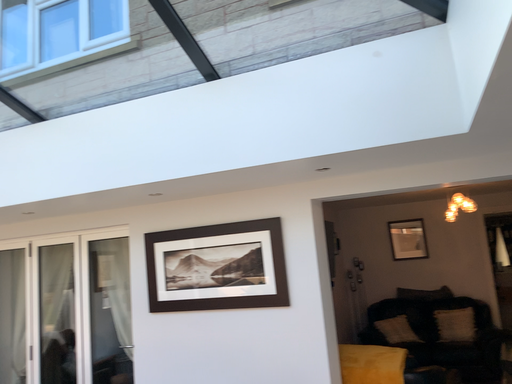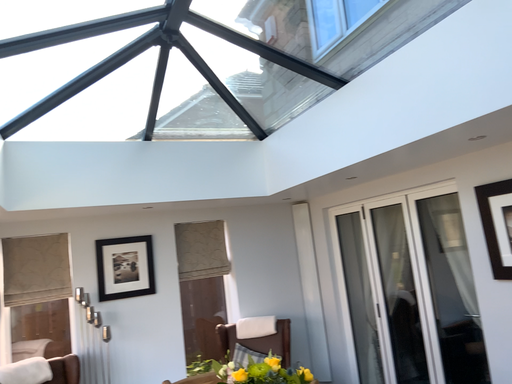
Question: Which way did the camera rotate in the video?

Choices:
 (A) rotated upward
 (B) rotated downward

Answer: (B)